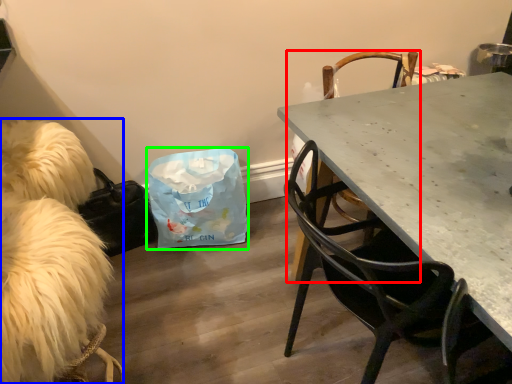
Question: Considering the real-world distances, which object is closest to chair (highlighted by a red box)? animal (highlighted by a blue box) or diaper bag (highlighted by a green box).

Choices:
 (A) animal
 (B) diaper bag

Answer: (B)